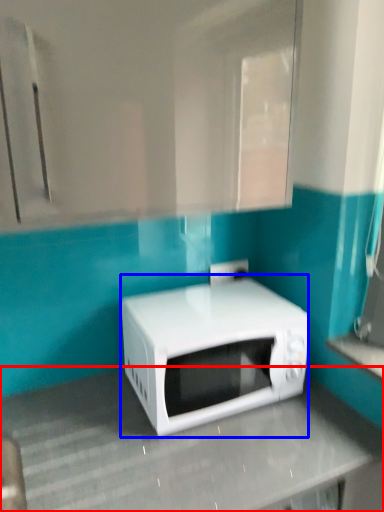
Question: Among these objects, which one is farthest to the camera, counter top (highlighted by a red box) or microwave oven (highlighted by a blue box)?

Choices:
 (A) counter top
 (B) microwave oven

Answer: (B)